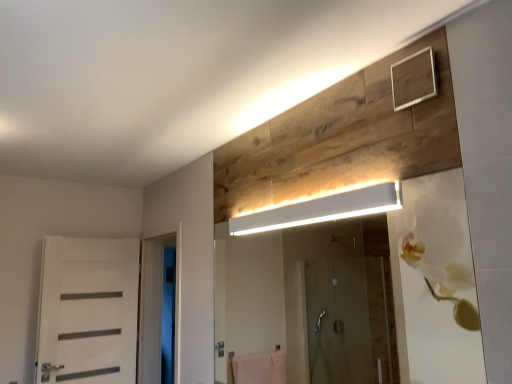
Describe the element at coordinates (322, 210) in the screenshot. I see `white matte rectangular light fixture at upper center` at that location.

Find the location of a particular element. The height and width of the screenshot is (384, 512). white matte rectangular light fixture at upper center is located at coordinates (322, 210).

Is white matte rectangular light fixture at upper center in front of or behind white glossy door at left in the image?

Clearly, white matte rectangular light fixture at upper center is in front of white glossy door at left.

Considering the relative sizes of white matte rectangular light fixture at upper center and white glossy door at left in the image provided, is white matte rectangular light fixture at upper center bigger than white glossy door at left?

No, white matte rectangular light fixture at upper center is not bigger than white glossy door at left.

Looking at this image, is white matte rectangular light fixture at upper center inside the boundaries of white glossy door at left, or outside?

white matte rectangular light fixture at upper center is not inside white glossy door at left, it's outside.

Is white glossy door at left not within white matte rectangular light fixture at upper center?

Yes, white glossy door at left is outside of white matte rectangular light fixture at upper center.

Which of these two, white glossy door at left or white matte rectangular light fixture at upper center, stands shorter?

white matte rectangular light fixture at upper center is shorter.

Is white glossy door at left looking in the opposite direction of white matte rectangular light fixture at upper center?

white glossy door at left does not have its back to white matte rectangular light fixture at upper center.

Would you say white glossy door at left is part of white matte door at left's contents?

No, white glossy door at left is not inside white matte door at left.

Locate an element on the screen. The height and width of the screenshot is (384, 512). door located below the white glossy door at left (from the image's perspective) is located at coordinates (88, 311).

What's the angular difference between white matte door at left and white glossy door at left's facing directions?

There is a 93.3-degree angle between the facing directions of white matte door at left and white glossy door at left.

Which of these two, white matte door at left or white glossy door at left, is bigger?

white glossy door at left is bigger.

From a real-world perspective, who is located lower, white matte rectangular light fixture at upper center or white matte door at left?

In real-world perspective, white matte door at left is lower.

Is white matte rectangular light fixture at upper center next to white matte door at left and touching it?

No, white matte rectangular light fixture at upper center is not touching white matte door at left.

Is white matte rectangular light fixture at upper center taller or shorter than white matte door at left?

Considering their sizes, white matte rectangular light fixture at upper center has less height than white matte door at left.

Can white matte door at left be found inside white matte rectangular light fixture at upper center?

No, white matte door at left is not surrounded by white matte rectangular light fixture at upper center.

Is white matte rectangular light fixture at upper center completely or partially inside white matte door at left?

No, white matte rectangular light fixture at upper center is not inside white matte door at left.

Who is bigger, white matte door at left or white matte rectangular light fixture at upper center?

Bigger between the two is white matte door at left.

Is white matte door at left further to the viewer compared to white matte rectangular light fixture at upper center?

Yes, white matte door at left is further from the camera.

Is white matte door at left with white matte rectangular light fixture at upper center?

No, white matte door at left is not next to white matte rectangular light fixture at upper center.

Which object is closer to the camera, white glossy door at left or white matte door at left?

white glossy door at left.

The image size is (512, 384). Find the location of `door located below the white glossy door at left (from the image's perspective)`. door located below the white glossy door at left (from the image's perspective) is located at coordinates (88, 311).

Is white glossy door at left at the right side of white matte door at left?

Indeed, white glossy door at left is positioned on the right side of white matte door at left.

Considering the sizes of objects white glossy door at left and white matte door at left in the image provided, who is taller, white glossy door at left or white matte door at left?

Standing taller between the two is white glossy door at left.

At what (x,y) coordinates should I click in order to perform the action: click on screen door below the white matte rectangular light fixture at upper center (from the image's perspective). Please return your answer as a coordinate pair (x, y). The height and width of the screenshot is (384, 512). Looking at the image, I should click on tap(157, 304).

There is a white glossy door at left. Find the location of `light fixture above it (from a real-world perspective)`. light fixture above it (from a real-world perspective) is located at coordinates (322, 210).

Which object lies further to the anchor point white matte door at left, white glossy door at left or white matte rectangular light fixture at upper center?

Based on the image, white matte rectangular light fixture at upper center appears to be further to white matte door at left.

When comparing their distances from white glossy door at left, does white matte rectangular light fixture at upper center or white matte door at left seem closer?

white matte door at left is closer to white glossy door at left.

Which object lies nearer to the anchor point white matte rectangular light fixture at upper center, white glossy door at left or white matte door at left?

white matte door at left is positioned closer to the anchor white matte rectangular light fixture at upper center.

Looking at the image, which one is located closer to white matte rectangular light fixture at upper center, white matte door at left or white glossy door at left?

Based on the image, white matte door at left appears to be nearer to white matte rectangular light fixture at upper center.

When comparing their distances from white glossy door at left, does white matte door at left or white matte rectangular light fixture at upper center seem further?

Among the two, white matte rectangular light fixture at upper center is located further to white glossy door at left.

Considering their positions, is white matte rectangular light fixture at upper center positioned closer to white matte door at left than white glossy door at left?

white glossy door at left lies closer to white matte door at left than the other object.

Where is `screen door located between white matte rectangular light fixture at upper center and white matte door at left in the depth direction`? screen door located between white matte rectangular light fixture at upper center and white matte door at left in the depth direction is located at coordinates (157, 304).